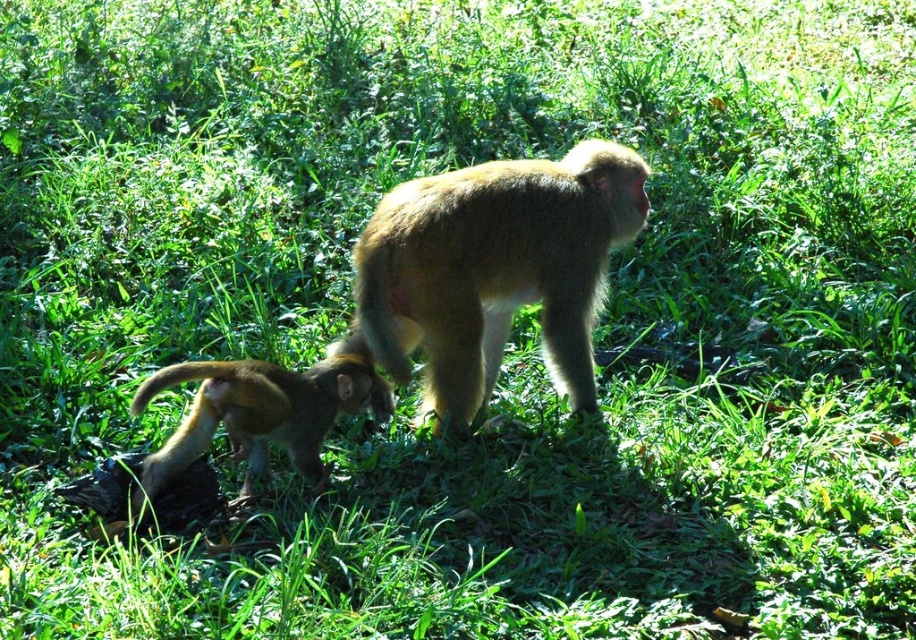
Between point (634, 157) and point (353, 360), which one is positioned behind?

Positioned behind is point (634, 157).

Is point (399, 337) positioned before point (306, 392)?

That is False.

At what (x,y) coordinates should I click in order to perform the action: click on golden fur monkey at center. Please return your answer as a coordinate pair (x, y). Looking at the image, I should click on (494, 269).